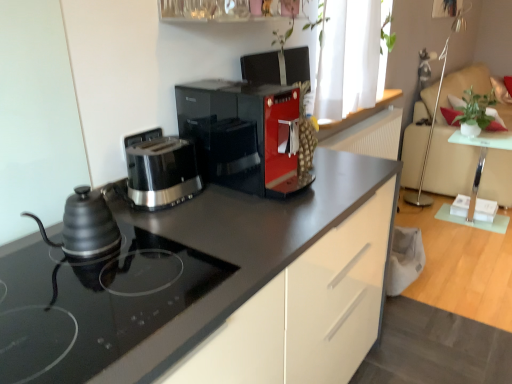
Where is `vacant space situated above satin black toaster at left (from a real-world perspective)`? The width and height of the screenshot is (512, 384). vacant space situated above satin black toaster at left (from a real-world perspective) is located at coordinates (159, 147).